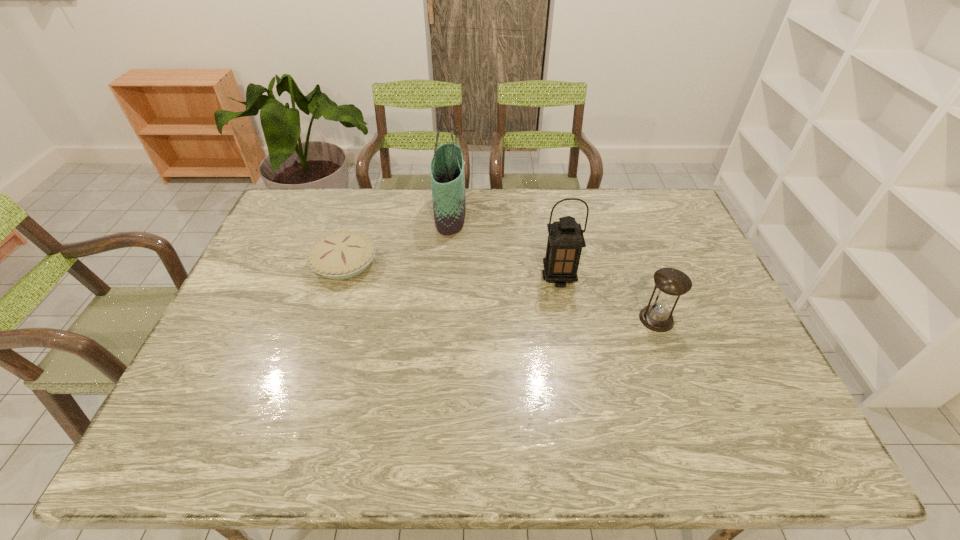
The image size is (960, 540). Identify the location of object that is the second closest to the tallest object. (565, 241).

This screenshot has height=540, width=960. In order to click on free space that satisfies the following two spatial constraints: 1. on the front side of the second object from right to left; 2. on the right side of the nearest object in this screenshot , I will do `click(565, 319)`.

In order to click on vacant space that satisfies the following two spatial constraints: 1. on the front side of the second shortest object; 2. on the left side of the pie in this screenshot , I will do `click(327, 319)`.

The image size is (960, 540). In order to click on vacant area that satisfies the following two spatial constraints: 1. on the front side of the pie; 2. on the left side of the nearest object in this screenshot , I will do `click(327, 319)`.